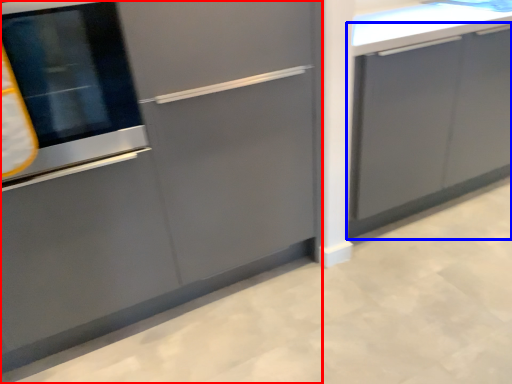
Question: Which point is further to the camera, cabinetry (highlighted by a red box) or cabinetry (highlighted by a blue box)?

Choices:
 (A) cabinetry
 (B) cabinetry

Answer: (B)